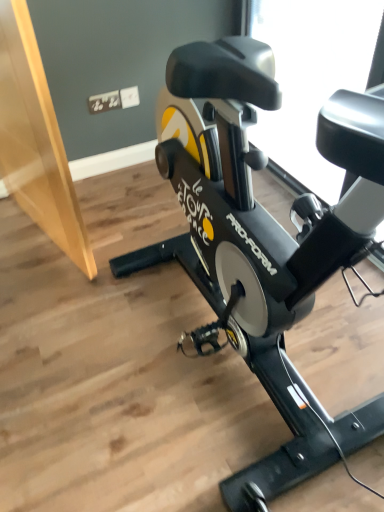
The height and width of the screenshot is (512, 384). I want to click on free region on the left part of black matte stationary bicycle at center, so click(x=70, y=362).